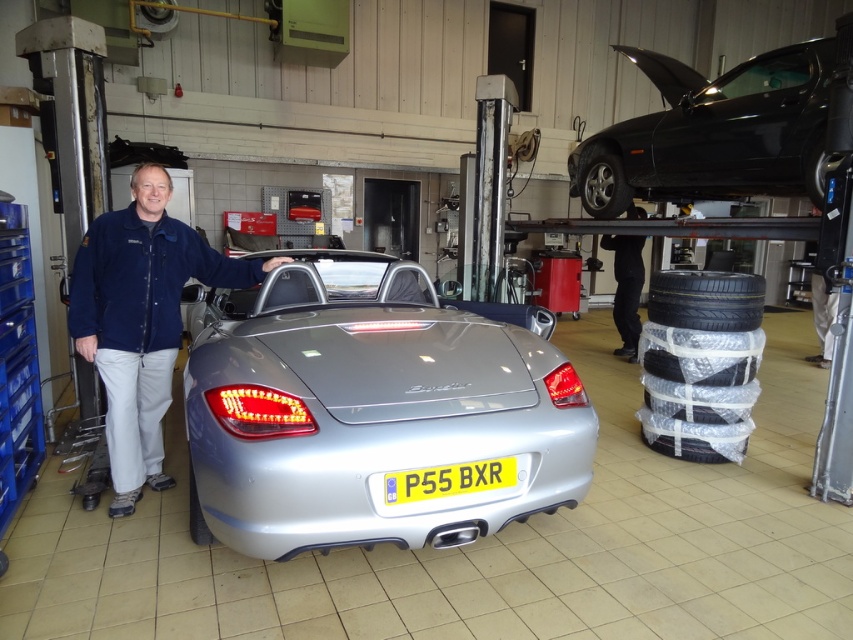
Can you confirm if shiny black car at upper right is positioned to the left of black rubber tire at right?

No, shiny black car at upper right is not to the left of black rubber tire at right.

Between point (763, 168) and point (723, 304), which one is positioned behind?

The point (763, 168) is behind.

Is point (827, 45) closer to viewer compared to point (753, 288)?

No, (827, 45) is behind (753, 288).

At what (x,y) coordinates should I click in order to perform the action: click on shiny black car at upper right. Please return your answer as a coordinate pair (x, y). Looking at the image, I should click on (714, 132).

Who is more distant from viewer, (717, 156) or (171, 262)?

The point (717, 156) is more distant.

Is shiny black car at upper right thinner than blue denim jacket at center?

In fact, shiny black car at upper right might be wider than blue denim jacket at center.

Measure the distance between shiny black car at upper right and camera.

They are 3.66 meters apart.

At what (x,y) coordinates should I click in order to perform the action: click on shiny black car at upper right. Please return your answer as a coordinate pair (x, y). Looking at the image, I should click on coord(714,132).

Does satin silver car at center appear on the right side of yellow plastic license plate at center?

In fact, satin silver car at center is to the left of yellow plastic license plate at center.

Which is above, satin silver car at center or yellow plastic license plate at center?

satin silver car at center

Is point (212, 340) closer to viewer compared to point (474, 465)?

That is False.

In order to click on satin silver car at center in this screenshot , I will do pos(374,412).